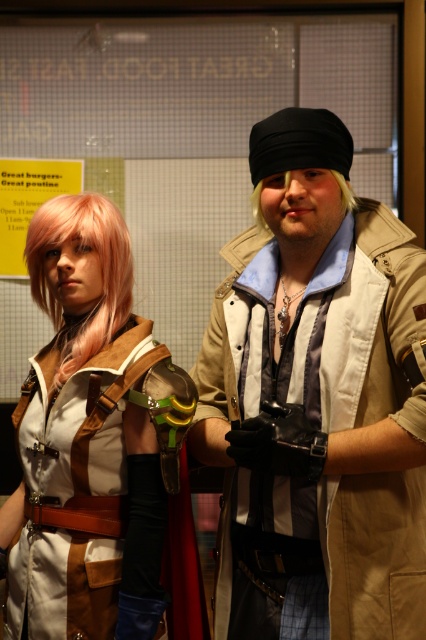
Question: Is matte beige jacket at center above blonde hair wig at center?

Choices:
 (A) no
 (B) yes

Answer: (A)

Question: Which point is closer to the camera?

Choices:
 (A) (310, 296)
 (B) (34, 566)

Answer: (A)

Question: Which of the following is the farthest from the observer?

Choices:
 (A) (342, 188)
 (B) (120, 310)
 (C) (368, 310)
 (D) (52, 506)

Answer: (B)

Question: Which is farther from the blonde hair wig at center?

Choices:
 (A) matte beige jacket at center
 (B) pink synthetic wig at left
 (C) matte brown vest at center

Answer: (C)

Question: Can you confirm if matte beige jacket at center is smaller than blonde hair wig at center?

Choices:
 (A) yes
 (B) no

Answer: (B)

Question: Is matte brown vest at center smaller than pink synthetic wig at left?

Choices:
 (A) no
 (B) yes

Answer: (A)